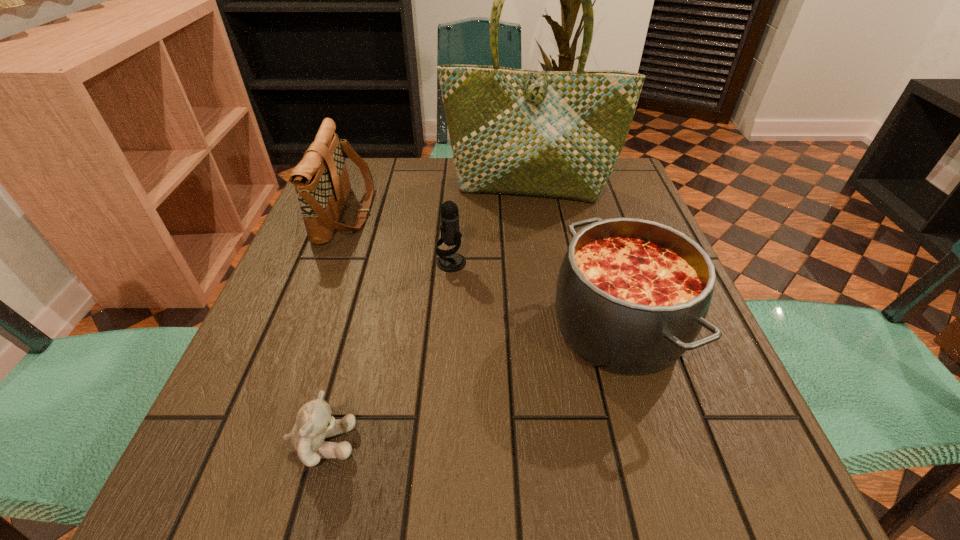
The image size is (960, 540). In order to click on vacant space that satisfies the following two spatial constraints: 1. on the front side of the shopping bag; 2. on the front-facing side of the shoulder bag in this screenshot , I will do `click(532, 213)`.

Locate an element on the screen. This screenshot has width=960, height=540. free space that satisfies the following two spatial constraints: 1. on the front side of the casserole; 2. on the face of the nearest object is located at coordinates (653, 443).

The width and height of the screenshot is (960, 540). What are the coordinates of `free space in the image that satisfies the following two spatial constraints: 1. on the front-facing side of the shoulder bag; 2. on the right side of the microphone` in the screenshot? It's located at (327, 263).